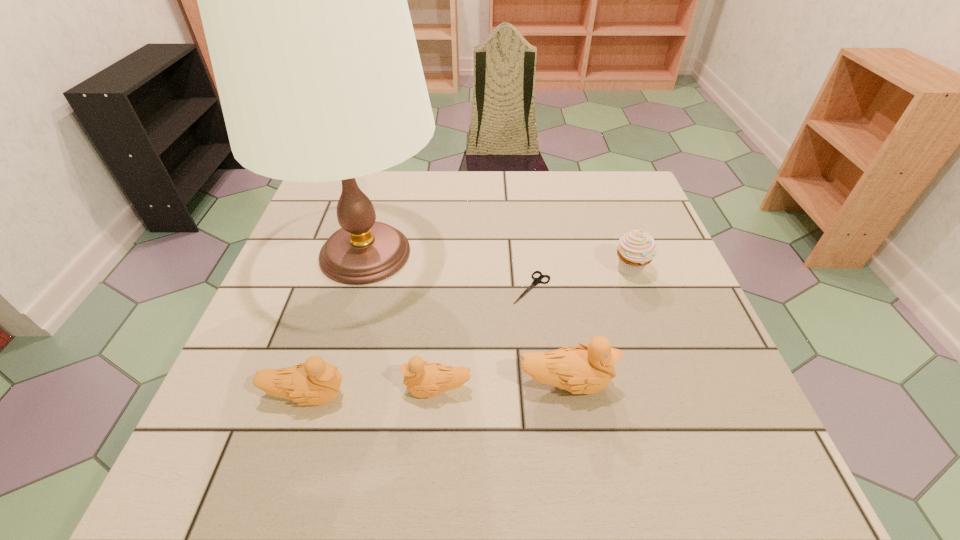
Where is `object positioned at the near left corner`? object positioned at the near left corner is located at coordinates (314, 382).

In the image, there is a desktop. Identify the location of vacant space at the far edge. (494, 192).

Locate an element on the screen. This screenshot has height=540, width=960. vacant space at the near edge of the desktop is located at coordinates (583, 407).

The image size is (960, 540). Identify the location of free region at the left edge. (288, 266).

Identify the location of free location at the right edge of the desktop. (697, 308).

The height and width of the screenshot is (540, 960). I want to click on vacant space at the far left corner of the desktop, so click(x=320, y=190).

The image size is (960, 540). In the image, there is a desktop. In order to click on vacant space at the near left corner in this screenshot , I will do `click(240, 384)`.

Identify the location of vacant space at the far right corner of the desktop. Image resolution: width=960 pixels, height=540 pixels. (593, 186).

Find the location of a particular element. The width and height of the screenshot is (960, 540). free space at the near right corner of the desktop is located at coordinates 690,388.

Image resolution: width=960 pixels, height=540 pixels. Find the location of `free space between the lamp and the muffin`. free space between the lamp and the muffin is located at coordinates (498, 262).